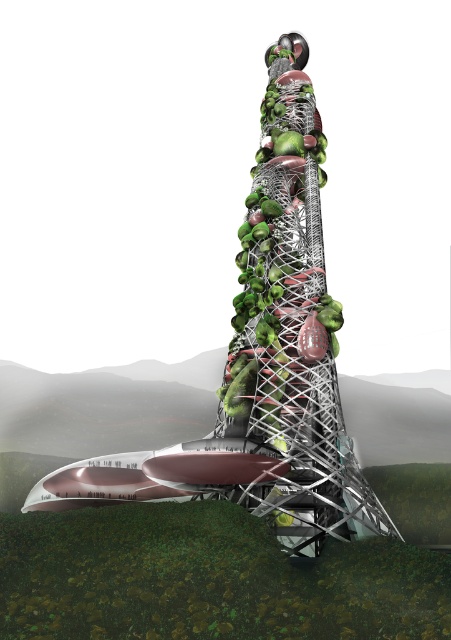
You are a delivery drone that needs to land on the platform. The platform has a brushed metal boat at center and metallic greenery at center. Which object should you avoid to ensure a safe landing?

The brushed metal boat at center is larger in size than metallic greenery at center, so you should avoid the brushed metal boat at center to ensure a safe landing area.

Looking at this image, you are standing on the circular platform at the base of the tower and want to reach the entrance of the tower. You see a brushed metal boat at center and metallic greenery at center. Which object is closer to you?

The brushed metal boat at center is closer to you because it is in front of the metallic greenery at center.